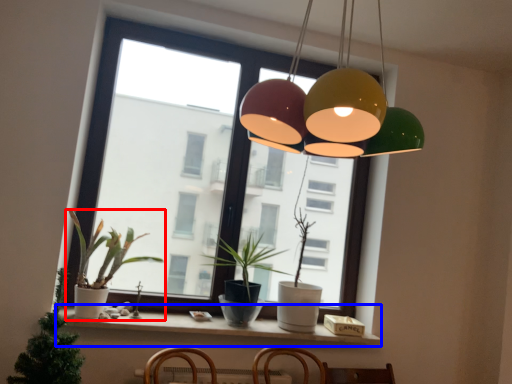
Question: Which object is closer to the camera taking this photo, houseplant (highlighted by a red box) or window sill (highlighted by a blue box)?

Choices:
 (A) houseplant
 (B) window sill

Answer: (A)